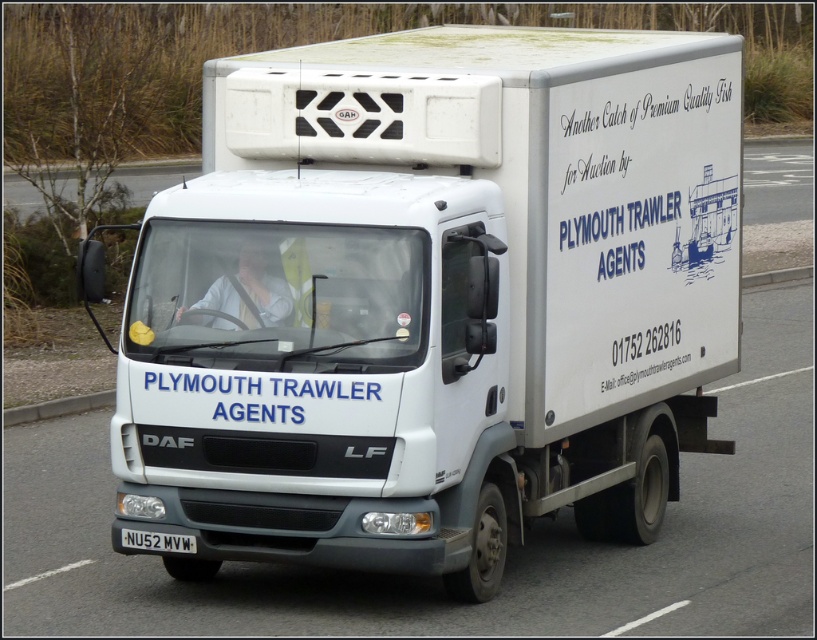
Is white matte truck at center bigger than white plastic license plate at lower center?

Indeed, white matte truck at center has a larger size compared to white plastic license plate at lower center.

Does point (371, 390) come closer to viewer compared to point (127, 540)?

Yes.

Find the location of a particular element. Image resolution: width=817 pixels, height=640 pixels. white matte truck at center is located at coordinates (432, 300).